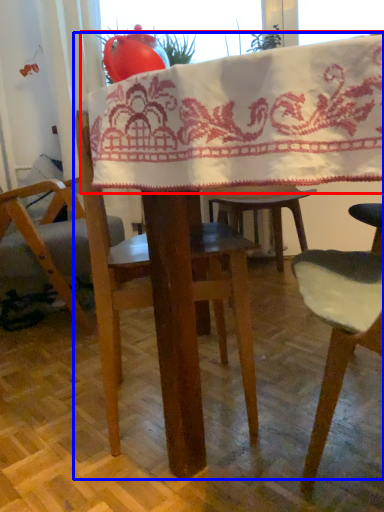
Question: Among these objects, which one is nearest to the camera, blanket (highlighted by a red box) or table (highlighted by a blue box)?

Choices:
 (A) blanket
 (B) table

Answer: (B)